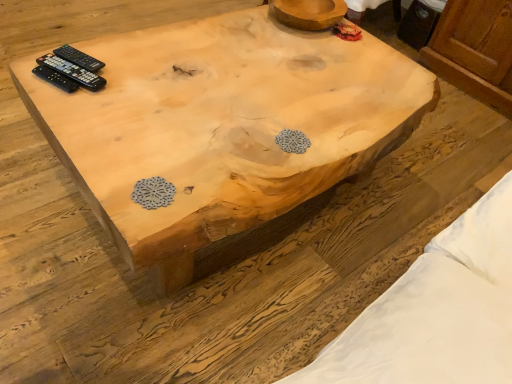
You are a GUI agent. You are given a task and a screenshot of the screen. Output one action in this format:
    pyautogui.click(x=<x>, y=<y>)
    Task: Click on the free space in front of black plastic remote controls at upper left, the second remote control from the back
    
    Given the screenshot: What is the action you would take?
    pyautogui.click(x=65, y=100)